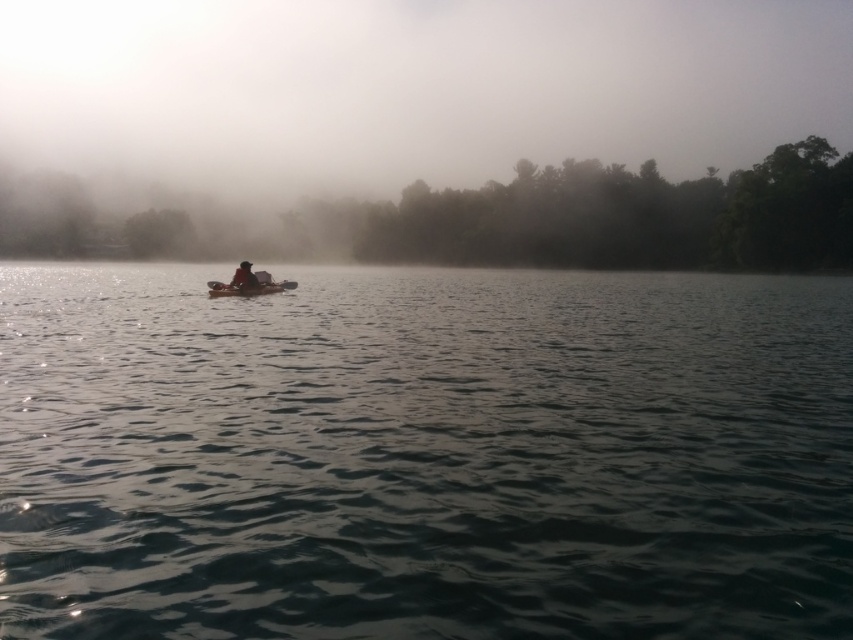
You are a photographer trying to capture the reflection of the matte black kayak at center in the clear water at center. Based on the scene description, can you confirm if the reflection would be visible?

The clear water at center is located below matte black kayak at center, so the reflection of the matte black kayak at center would be visible in the clear water at center since the water is still and reflective as described in the scene.

You are a photographer trying to capture the smooth brown canoe at center in the image. According to the coordinates provided, where exactly would you position your camera to ensure the canoe is centered in your shot?

To center the smooth brown canoe at center in your shot, position your camera at the coordinates point (248,288) as specified.